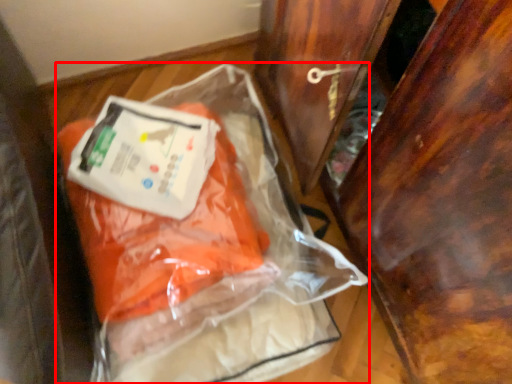
Question: From the image's perspective, what is the correct spatial positioning of plastic bag (annotated by the red box) in reference to furniture?

Choices:
 (A) above
 (B) below

Answer: (B)